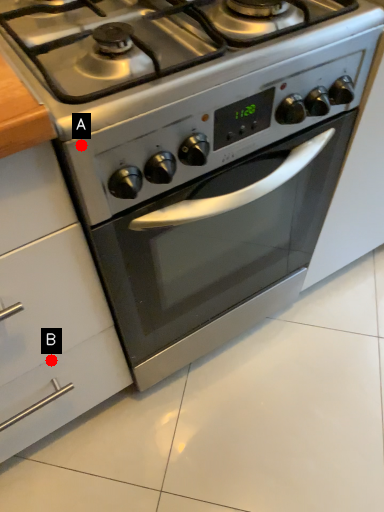
Question: Two points are circled on the image, labeled by A and B beside each circle. Which point appears closest to the camera in this image?

Choices:
 (A) A is closer
 (B) B is closer

Answer: (A)